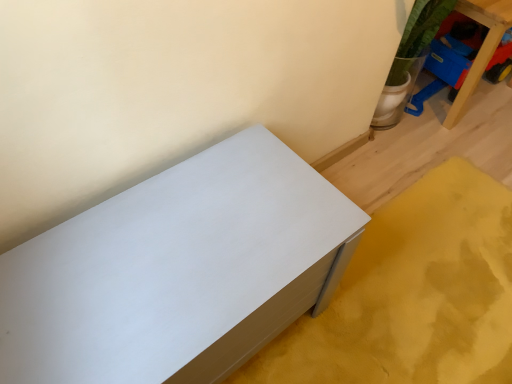
Question: Considering the relative positions of blue plastic toy at upper right, which is counted as the 1th furniture, starting from the top, and white matte chest of drawers at lower left, the first furniture when ordered from front to back, in the image provided, is blue plastic toy at upper right, which is counted as the 1th furniture, starting from the top, in front of white matte chest of drawers at lower left, the first furniture when ordered from front to back,?

Choices:
 (A) no
 (B) yes

Answer: (A)

Question: Is blue plastic toy at upper right, which is counted as the 1th furniture, starting from the top, facing towards white matte chest of drawers at lower left, which is the 2th furniture from back to front?

Choices:
 (A) yes
 (B) no

Answer: (B)

Question: Does blue plastic toy at upper right, the second furniture viewed from the left, appear on the left side of white matte chest of drawers at lower left, the first furniture when ordered from front to back?

Choices:
 (A) yes
 (B) no

Answer: (B)

Question: Can you confirm if blue plastic toy at upper right, marked as the second furniture in a bottom-to-top arrangement, is smaller than white matte chest of drawers at lower left, which is the second furniture in top-to-bottom order?

Choices:
 (A) no
 (B) yes

Answer: (B)

Question: From a real-world perspective, is blue plastic toy at upper right, the first furniture positioned from the right, located higher than white matte chest of drawers at lower left, acting as the 1th furniture starting from the bottom?

Choices:
 (A) yes
 (B) no

Answer: (A)

Question: Considering the relative sizes of blue plastic toy at upper right, the first furniture positioned from the right, and white matte chest of drawers at lower left, acting as the 1th furniture starting from the bottom, in the image provided, is blue plastic toy at upper right, the first furniture positioned from the right, taller than white matte chest of drawers at lower left, acting as the 1th furniture starting from the bottom,?

Choices:
 (A) yes
 (B) no

Answer: (A)

Question: Is white matte chest of drawers at lower left, acting as the 1th furniture starting from the bottom, to the right of blue plastic toy at upper right, marked as the first furniture in a back-to-front arrangement, from the viewer's perspective?

Choices:
 (A) no
 (B) yes

Answer: (A)

Question: Does white matte chest of drawers at lower left, acting as the 1th furniture starting from the bottom, have a smaller size compared to blue plastic toy at upper right, the first furniture positioned from the right?

Choices:
 (A) yes
 (B) no

Answer: (B)

Question: Is white matte chest of drawers at lower left, which is the 2th furniture from back to front, wider than blue plastic toy at upper right, the second furniture viewed from the left?

Choices:
 (A) yes
 (B) no

Answer: (A)

Question: Could you tell me if white matte chest of drawers at lower left, the first furniture when ordered from front to back, is facing blue plastic toy at upper right, which is counted as the 1th furniture, starting from the top?

Choices:
 (A) no
 (B) yes

Answer: (A)

Question: Are white matte chest of drawers at lower left, which is the 2th furniture from back to front, and blue plastic toy at upper right, marked as the second furniture in a bottom-to-top arrangement, beside each other?

Choices:
 (A) yes
 (B) no

Answer: (B)

Question: Is blue plastic toy at upper right, the first furniture positioned from the right, a part of white matte chest of drawers at lower left, the 1th furniture positioned from the left?

Choices:
 (A) yes
 (B) no

Answer: (B)

Question: From their relative heights in the image, would you say white matte chest of drawers at lower left, the 2th furniture when ordered from right to left, is taller or shorter than blue plastic toy at upper right, which is counted as the 1th furniture, starting from the top?

Choices:
 (A) short
 (B) tall

Answer: (A)